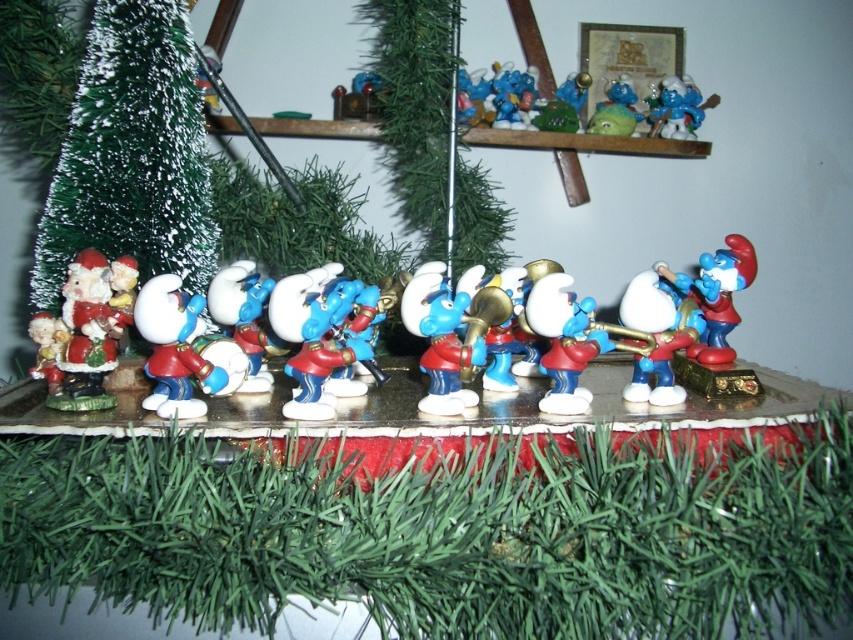
Is blue glossy smurf at center positioned behind matte blue plastic smurf at right?

No, it is in front of matte blue plastic smurf at right.

Measure the distance between blue glossy smurf at center and camera.

blue glossy smurf at center is 29.15 inches away from camera.

Is point (587, 337) more distant than point (704, 336)?

No, (587, 337) is closer to viewer.

The height and width of the screenshot is (640, 853). In order to click on blue glossy smurf at center in this screenshot , I will do `click(563, 340)`.

Can you confirm if matte plastic santa at left is positioned below blue glossy smurf at center?

No.

Which is in front, point (656, 348) or point (584, 314)?

Point (584, 314)

You are a GUI agent. You are given a task and a screenshot of the screen. Output one action in this format:
    pyautogui.click(x=<x>, y=<y>)
    Task: Click on the matte plastic santa at left
    Image resolution: width=853 pixels, height=640 pixels.
    Given the screenshot: What is the action you would take?
    pyautogui.click(x=550, y=333)

Who is lower down, matte plastic santa at left or matte blue plastic smurf at right?

matte plastic santa at left is below.

Which is more to the left, matte plastic santa at left or matte blue plastic smurf at right?

matte plastic santa at left is more to the left.

Which is in front, point (671, 346) or point (730, 316)?

Positioned in front is point (671, 346).

Find the location of a particular element. matte plastic santa at left is located at coordinates (550, 333).